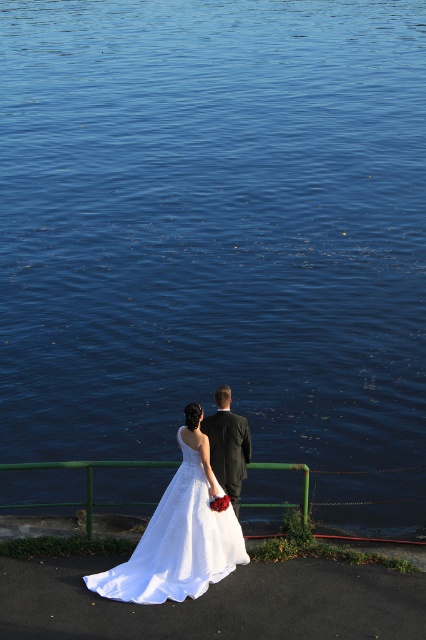
Does shiny black suit at center have a larger size compared to green painted metal railing at lower center?

Incorrect, shiny black suit at center is not larger than green painted metal railing at lower center.

Where is `shiny black suit at center`? The image size is (426, 640). shiny black suit at center is located at coordinates (227, 445).

Who is positioned more to the right, white satin dress at lower center or green painted metal railing at lower center?

From the viewer's perspective, white satin dress at lower center appears more on the right side.

Which of these two, white satin dress at lower center or green painted metal railing at lower center, stands shorter?

With less height is green painted metal railing at lower center.

This screenshot has height=640, width=426. In order to click on white satin dress at lower center in this screenshot , I will do `click(178, 540)`.

Can you confirm if white satin dress at lower center is shorter than shiny black suit at center?

No, white satin dress at lower center is not shorter than shiny black suit at center.

How far apart are white satin dress at lower center and shiny black suit at center?

white satin dress at lower center is 24.01 inches away from shiny black suit at center.

The image size is (426, 640). In order to click on white satin dress at lower center in this screenshot , I will do `click(178, 540)`.

Identify the location of white satin dress at lower center. click(178, 540).